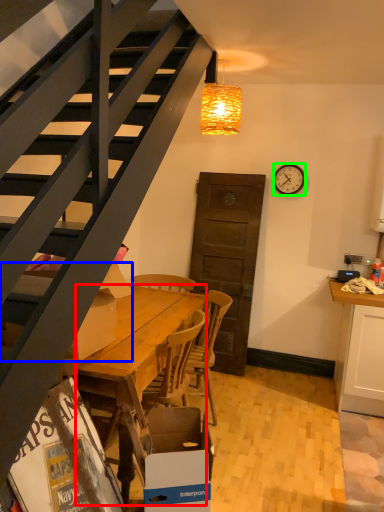
Question: Which is farther away from desk (highlighted by a red box)? box (highlighted by a blue box) or clock (highlighted by a green box)?

Choices:
 (A) box
 (B) clock

Answer: (B)